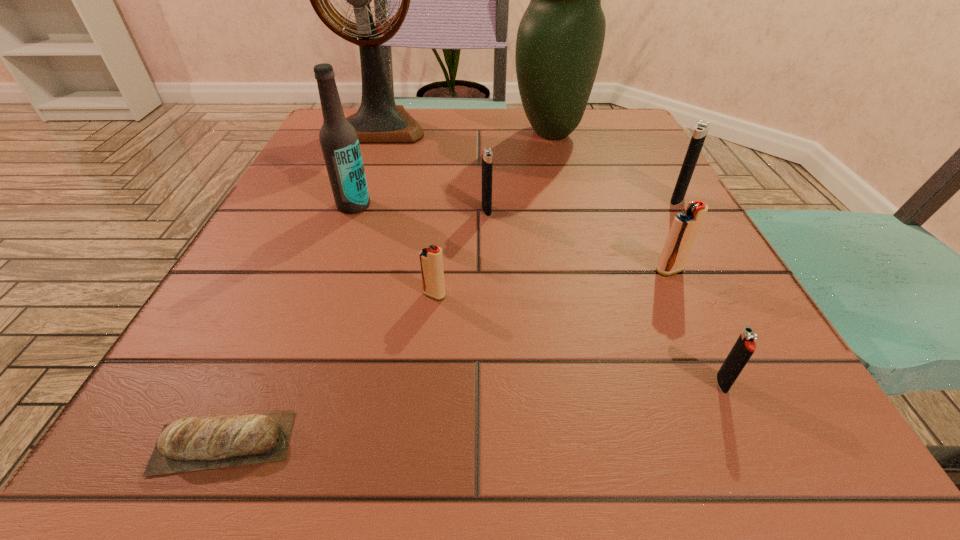
This screenshot has width=960, height=540. Identify the location of free space located on the left of the tallest igniter. (539, 200).

You are a GUI agent. You are given a task and a screenshot of the screen. Output one action in this format:
    pyautogui.click(x=<x>, y=<y>)
    Task: Click on the vacant space situated 0.360m on the front of the fourth igniter from right to left
    The height and width of the screenshot is (540, 960).
    Given the screenshot: What is the action you would take?
    pyautogui.click(x=491, y=396)

Where is `free space located 0.170m on the left of the third nearest igniter`? Image resolution: width=960 pixels, height=540 pixels. free space located 0.170m on the left of the third nearest igniter is located at coordinates (544, 270).

Where is `free space located 0.170m on the front of the second nearest igniter`? free space located 0.170m on the front of the second nearest igniter is located at coordinates (422, 408).

Where is `free space located 0.110m on the left of the nearest igniter`? The image size is (960, 540). free space located 0.110m on the left of the nearest igniter is located at coordinates (625, 383).

You are a GUI agent. You are given a task and a screenshot of the screen. Output one action in this format:
    pyautogui.click(x=<x>, y=<y>)
    Task: Click on the free region located on the right of the shortest object
    
    Given the screenshot: What is the action you would take?
    pyautogui.click(x=524, y=442)

Locate an element on the screen. The height and width of the screenshot is (540, 960). fan that is at the far edge is located at coordinates click(378, 120).

Locate an element on the screen. vase that is at the far edge is located at coordinates (560, 38).

At what (x,y) coordinates should I click in order to perform the action: click on object that is positioned at the near edge. Please return your answer as a coordinate pair (x, y). Looking at the image, I should click on (228, 440).

I want to click on fan present at the left edge, so point(378,120).